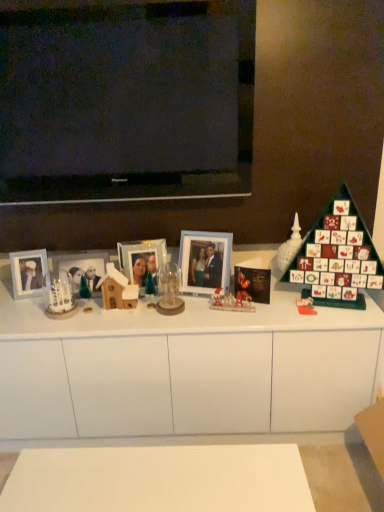
Where is `free space between clear glass ornament at center, positioned as the fourth toy in right-to-left order, and matte plastic toy at right, the 5th toy viewed from the left`? The height and width of the screenshot is (512, 384). free space between clear glass ornament at center, positioned as the fourth toy in right-to-left order, and matte plastic toy at right, the 5th toy viewed from the left is located at coordinates (239, 309).